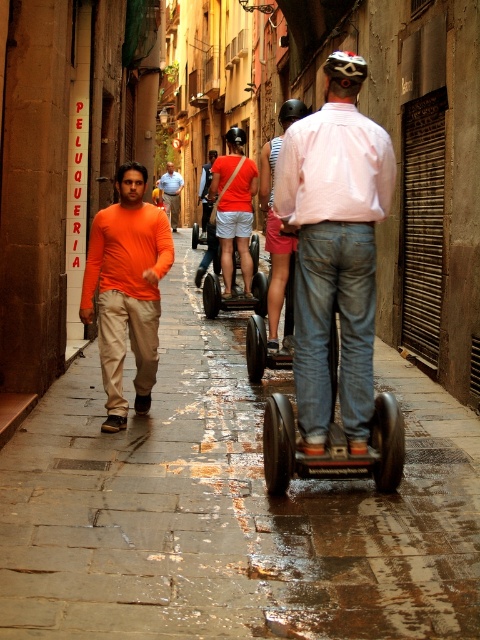
You are standing at the point marked as point (122, 557) in the image. You want to cross the alley to the other side. The Segways are moving away from you. Is there enough space between you and the Segways to safely cross?

The Segways are 4.12 meters away from point (122, 557), so there is sufficient space to safely cross the alley before the Segways approach.

You are standing at the entrance of the alleyway and see the rubberized black scooter at center. If you walk straight ahead, will you reach the scooter before the Segways behind it?

The rubberized black scooter at center is located at point (x=334, y=440), which is closer to your current position at the entrance than the Segways behind it. Therefore, you will reach the scooter before the Segways arrive.

You are a tourist in Barcelona and see the wet stone pavement at center and the pink fabric shorts at center in the alleyway. Which object is located to the left of the other?

The wet stone pavement at center is positioned on the left side of pink fabric shorts at center.